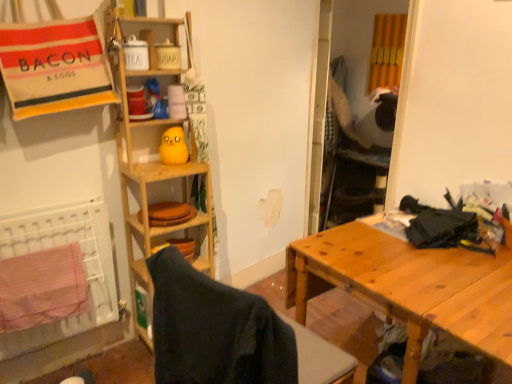
Question: Considering the positions of yellow matte plush toy at upper center and wooden shelf at center in the image, is yellow matte plush toy at upper center taller or shorter than wooden shelf at center?

Choices:
 (A) tall
 (B) short

Answer: (B)

Question: From the image's perspective, relative to wooden shelf at center, is yellow matte plush toy at upper center above or below?

Choices:
 (A) above
 (B) below

Answer: (A)

Question: Which object is positioned closest to the wooden table at right?

Choices:
 (A) wooden folding chair at center
 (B) yellow matte plush toy at upper center
 (C) wooden shelf at center
 (D) red checkered beach towel at lower left

Answer: (A)

Question: Which is farther from the yellow matte plush toy at upper center?

Choices:
 (A) red checkered beach towel at lower left
 (B) wooden shelf at center
 (C) wooden folding chair at center
 (D) wooden table at right

Answer: (D)